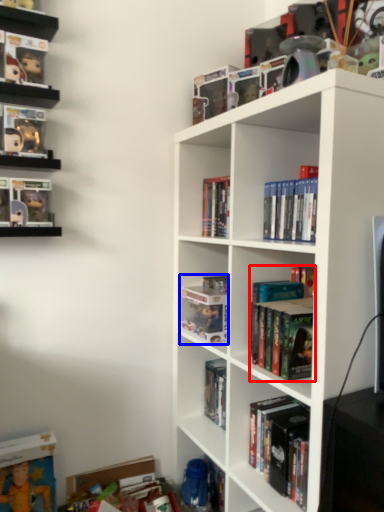
Question: Which object is closer to the camera taking this photo, book (highlighted by a red box) or book (highlighted by a blue box)?

Choices:
 (A) book
 (B) book

Answer: (A)